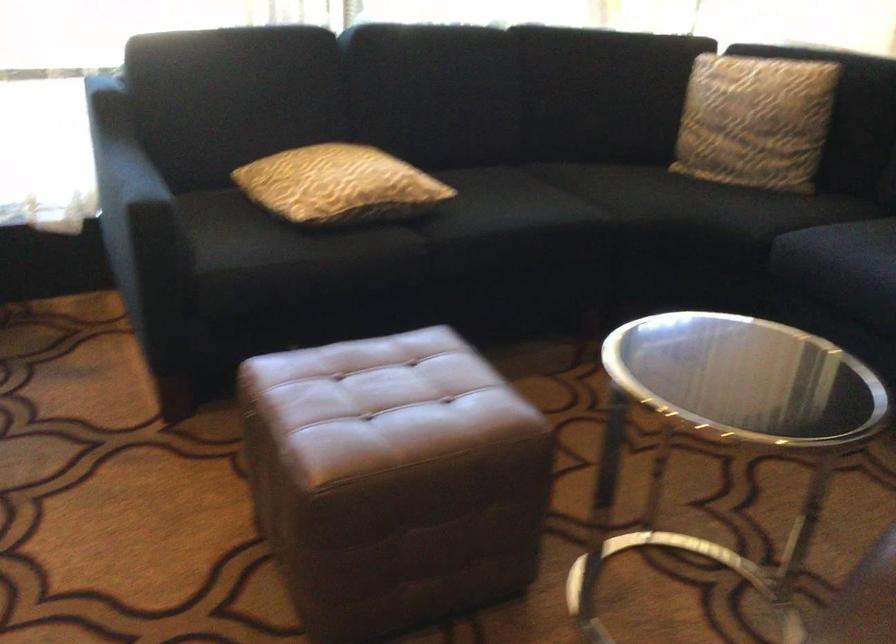
Find where to rest the sofa armrest. Please return your answer as a coordinate pair (x, y).

(118, 162)